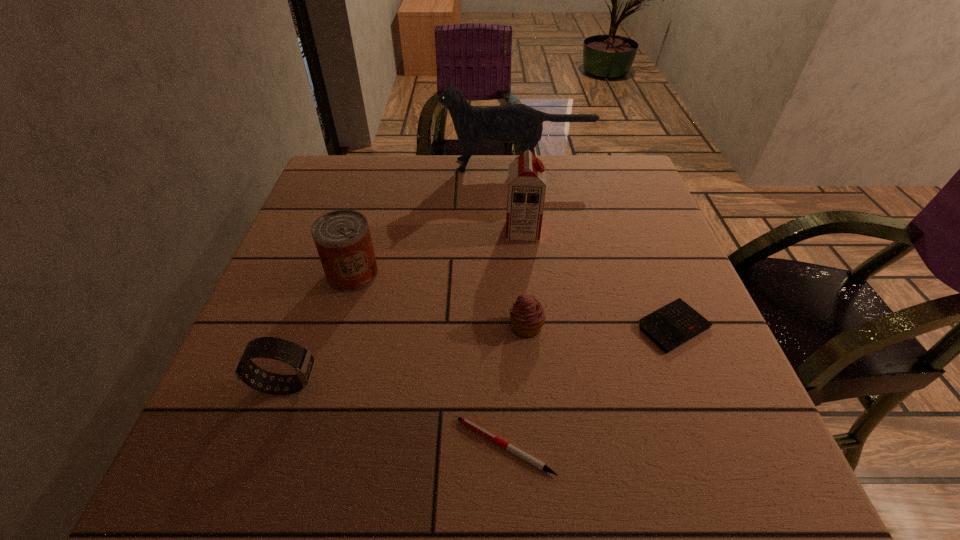
You are a GUI agent. You are given a task and a screenshot of the screen. Output one action in this format:
    pyautogui.click(x=<x>, y=<y>)
    Task: Click on the farthest object
    The image size is (960, 540).
    Given the screenshot: What is the action you would take?
    pyautogui.click(x=516, y=122)

Identify the location of the second farthest object. (526, 179).

Find the location of a particular element. This screenshot has height=540, width=960. the fifth nearest object is located at coordinates (342, 237).

Identify the location of can. (342, 237).

Locate an element on the screen. The image size is (960, 540). the sixth farthest object is located at coordinates (300, 358).

You are a GUI agent. You are given a task and a screenshot of the screen. Output one action in this format:
    pyautogui.click(x=<x>, y=<y>)
    Task: Click on the fourth tallest object
    Image resolution: width=960 pixels, height=540 pixels.
    Given the screenshot: What is the action you would take?
    pyautogui.click(x=300, y=358)

At what (x,y) coordinates should I click in order to perform the action: click on cupcake. Please return your answer as a coordinate pair (x, y). This screenshot has height=540, width=960. Looking at the image, I should click on (527, 316).

Locate an element on the screen. Image resolution: width=960 pixels, height=540 pixels. the second shortest object is located at coordinates (674, 324).

Locate an element on the screen. Image resolution: width=960 pixels, height=540 pixels. the nearest object is located at coordinates (464, 421).

The height and width of the screenshot is (540, 960). I want to click on the shortest object, so click(x=464, y=421).